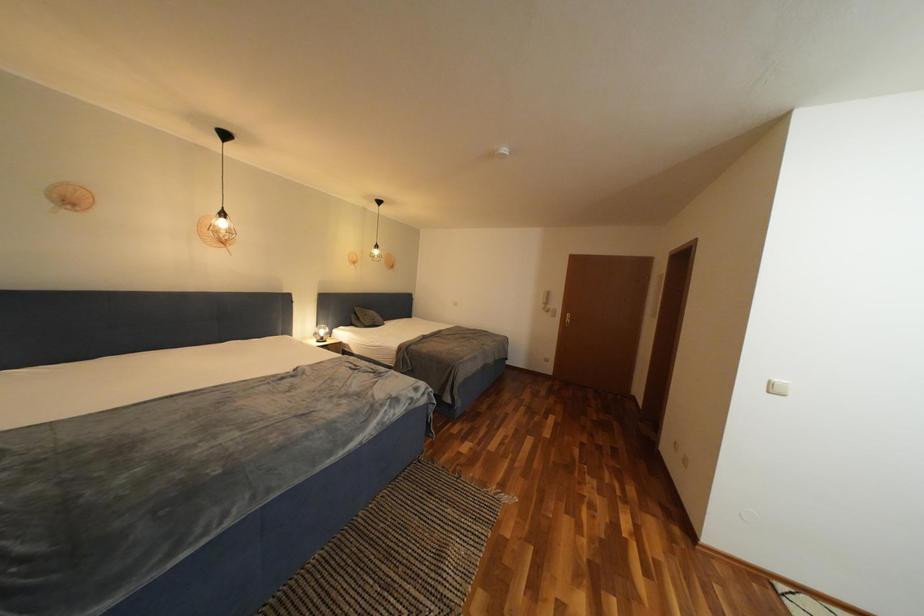
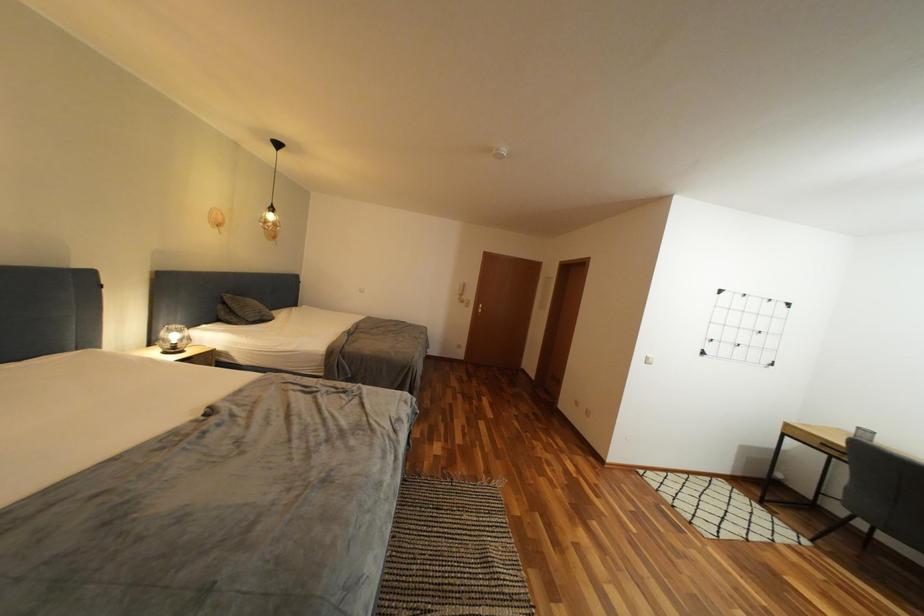
Question: How did the camera likely rotate?

Choices:
 (A) Left
 (B) Right
 (C) Up
 (D) Down

Answer: (B)